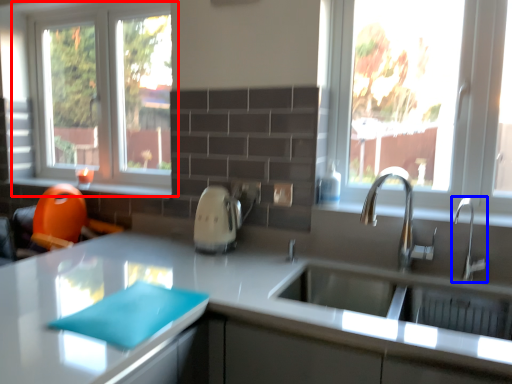
Question: Which point is closer to the camera, window (highlighted by a red box) or tap (highlighted by a blue box)?

Choices:
 (A) window
 (B) tap

Answer: (B)